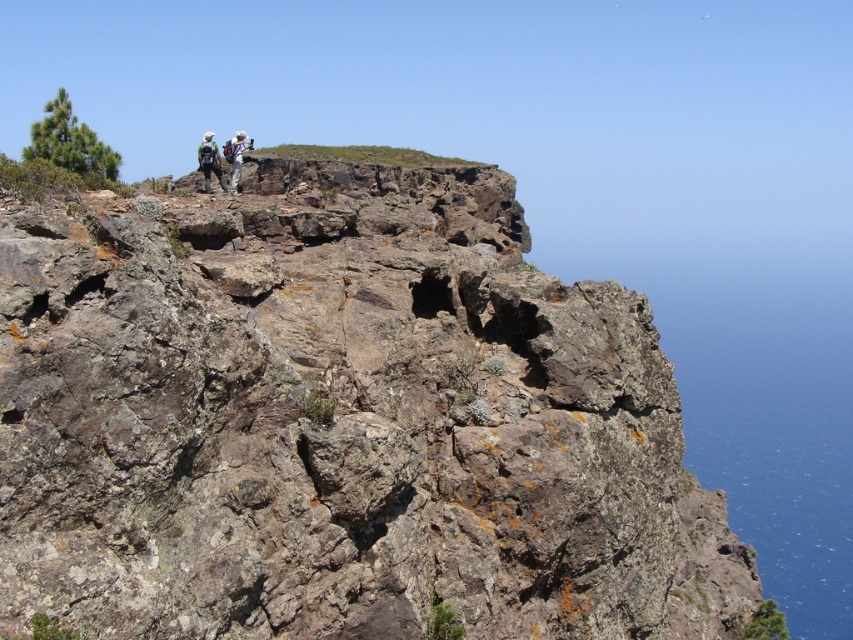
Question: Can you confirm if rocky at upper center is positioned below white fabric backpack at upper center?

Choices:
 (A) yes
 (B) no

Answer: (A)

Question: Which point is farther from the camera taking this photo?

Choices:
 (A) (241, 157)
 (B) (357, 196)

Answer: (B)

Question: Is rocky at upper center below white fabric backpack at upper center?

Choices:
 (A) yes
 (B) no

Answer: (A)

Question: Does rocky at upper center have a larger size compared to white fabric backpack at upper center?

Choices:
 (A) no
 (B) yes

Answer: (B)

Question: Which point appears farthest from the camera in this image?

Choices:
 (A) (383, 269)
 (B) (236, 134)

Answer: (B)